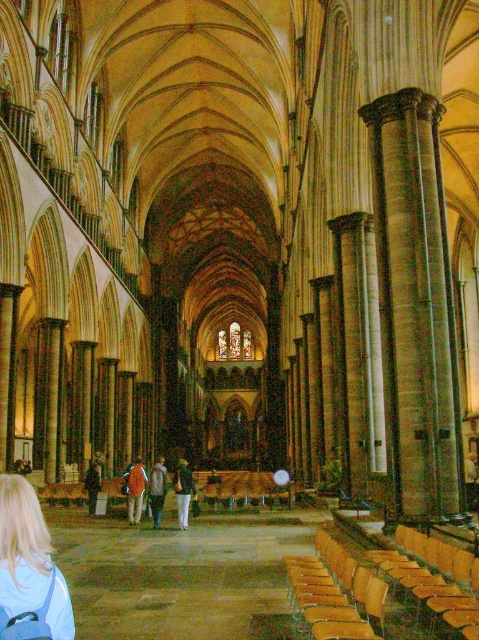
Looking at this image, you are an interior designer planning to place a new decorative item in the cathedral. You have a narrow decorative item that must fit between the wooden polished chair at lower right and the green textured shirt at center. Based on their widths, will the item fit?

The wooden polished chair at lower right has a lesser width compared to the green textured shirt at center. Since the decorative item is narrow, it should fit between them as the chair is narrower than the shirt.

You are a photographer setting up a shoot in the cathedral. You have two items to place on a pedestal at the center of the nave. The orange fabric pants at center and the denim jacket at center. If you want to ensure that both items are visible from the back of the nave, which item should you place higher on the pedestal?

The orange fabric pants at center has a lesser height compared to the denim jacket at center, so to ensure visibility from the back of the nave, you should place the orange fabric pants at center higher on the pedestal to compensate for its smaller size.